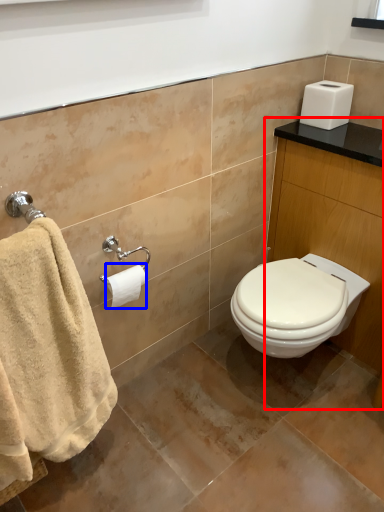
Question: Which of the following is the farthest to the observer, vanity (highlighted by a red box) or toilet paper (highlighted by a blue box)?

Choices:
 (A) vanity
 (B) toilet paper

Answer: (B)